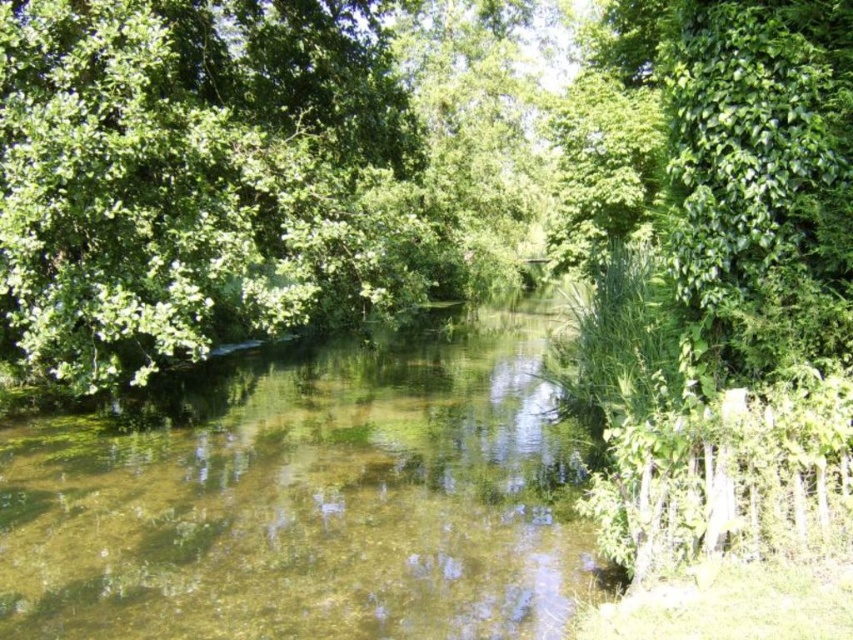
Does green leafy tree at center have a larger size compared to clear water at center?

Yes.

What do you see at coordinates (251, 172) in the screenshot? The width and height of the screenshot is (853, 640). I see `green leafy tree at center` at bounding box center [251, 172].

Identify the location of green leafy tree at center. The image size is (853, 640). (251, 172).